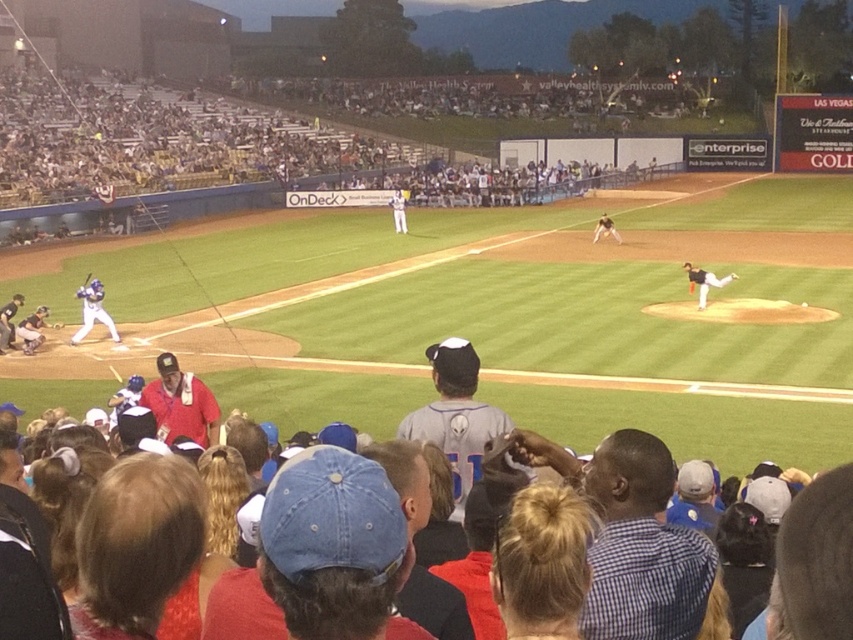
Does white uniform at center have a smaller size compared to dark brown leather glove at center?

No, white uniform at center is not smaller than dark brown leather glove at center.

Is white uniform at center wider than dark brown leather glove at center?

Incorrect, white uniform at center's width does not surpass dark brown leather glove at center's.

This screenshot has height=640, width=853. Identify the location of white uniform at center. (398, 211).

Which is more to the left, matte blue uniform at left or dark brown leather glove at center?

matte blue uniform at left is more to the left.

Does matte blue uniform at left appear on the left side of dark brown leather glove at center?

Yes, matte blue uniform at left is to the left of dark brown leather glove at center.

Between point (100, 289) and point (605, 218), which one is positioned behind?

The point (605, 218) is more distant.

Image resolution: width=853 pixels, height=640 pixels. In order to click on matte blue uniform at left in this screenshot , I will do `click(93, 310)`.

Can you confirm if matte blue uniform at left is wider than white uniform at center?

In fact, matte blue uniform at left might be narrower than white uniform at center.

Measure the distance between matte blue uniform at left and white uniform at center.

matte blue uniform at left is 22.45 meters away from white uniform at center.

Between point (79, 339) and point (389, 198), which one is positioned in front?

Point (79, 339)

The height and width of the screenshot is (640, 853). I want to click on matte blue uniform at left, so click(93, 310).